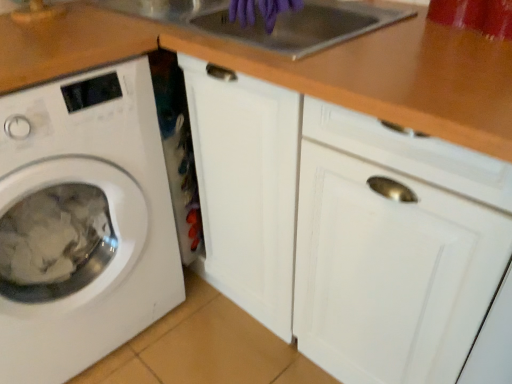
Question: Is wooden at upper center at the back of white matte washing machine at left?

Choices:
 (A) no
 (B) yes

Answer: (A)

Question: Is white matte washing machine at left closer to the viewer compared to wooden at upper center?

Choices:
 (A) yes
 (B) no

Answer: (A)

Question: Can you confirm if white matte washing machine at left is shorter than wooden at upper center?

Choices:
 (A) no
 (B) yes

Answer: (A)

Question: Considering the relative sizes of white matte washing machine at left and wooden at upper center in the image provided, is white matte washing machine at left smaller than wooden at upper center?

Choices:
 (A) no
 (B) yes

Answer: (A)

Question: Are white matte washing machine at left and wooden at upper center making contact?

Choices:
 (A) no
 (B) yes

Answer: (A)

Question: Considering the positions of white matte washing machine at left and wooden at upper center in the image, is white matte washing machine at left bigger or smaller than wooden at upper center?

Choices:
 (A) big
 (B) small

Answer: (A)

Question: Is white matte washing machine at left taller or shorter than wooden at upper center?

Choices:
 (A) short
 (B) tall

Answer: (B)

Question: Is point (8, 324) positioned closer to the camera than point (481, 99)?

Choices:
 (A) closer
 (B) farther

Answer: (B)

Question: Is white matte washing machine at left wider or thinner than wooden at upper center?

Choices:
 (A) thin
 (B) wide

Answer: (B)

Question: In terms of height, does wooden at upper center look taller or shorter compared to purple rubber gloves at upper center?

Choices:
 (A) tall
 (B) short

Answer: (B)

Question: Visually, is wooden at upper center positioned to the left or to the right of purple rubber gloves at upper center?

Choices:
 (A) left
 (B) right

Answer: (A)

Question: Considering the positions of wooden at upper center and purple rubber gloves at upper center in the image, is wooden at upper center wider or thinner than purple rubber gloves at upper center?

Choices:
 (A) wide
 (B) thin

Answer: (A)

Question: Is point (100, 39) closer or farther from the camera than point (245, 3)?

Choices:
 (A) closer
 (B) farther

Answer: (A)

Question: Is purple rubber gloves at upper center in front of or behind white matte washing machine at left in the image?

Choices:
 (A) front
 (B) behind

Answer: (B)

Question: From the image's perspective, relative to white matte washing machine at left, is purple rubber gloves at upper center above or below?

Choices:
 (A) above
 (B) below

Answer: (A)